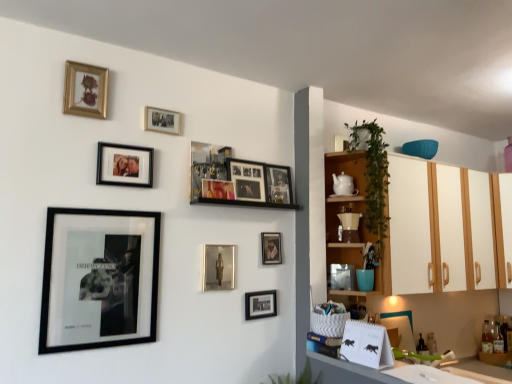
Question: Considering the relative sizes of green leafy plant at lower center, the 2th plant from the top, and matte black picture frame at center, the second picture frame positioned from the right, in the image provided, is green leafy plant at lower center, the 2th plant from the top, bigger than matte black picture frame at center, the second picture frame positioned from the right,?

Choices:
 (A) yes
 (B) no

Answer: (A)

Question: Would you consider green leafy plant at lower center, positioned as the 2th plant in right-to-left order, to be distant from matte black picture frame at center, the second picture frame positioned from the right?

Choices:
 (A) yes
 (B) no

Answer: (B)

Question: From the image's perspective, is green leafy plant at lower center, marked as the first plant in a left-to-right arrangement, on top of matte black picture frame at center, which is the 10th picture frame in left-to-right order?

Choices:
 (A) yes
 (B) no

Answer: (B)

Question: Is the position of green leafy plant at lower center, marked as the first plant in a left-to-right arrangement, more distant than that of matte black picture frame at center, which is the 10th picture frame in left-to-right order?

Choices:
 (A) no
 (B) yes

Answer: (A)

Question: Is green leafy plant at lower center, marked as the first plant in a left-to-right arrangement, taller than matte black picture frame at center, which is the 10th picture frame in left-to-right order?

Choices:
 (A) no
 (B) yes

Answer: (A)

Question: From a real-world perspective, relative to matte black photo frame at upper center, the 3th picture frame viewed from the left, is metallic/reflective picture frame at upper center, placed as the 5th picture frame when sorted from left to right, vertically above or below?

Choices:
 (A) above
 (B) below

Answer: (A)

Question: In the image, is metallic/reflective picture frame at upper center, the 7th picture frame positioned from the right, positioned in front of or behind matte black photo frame at upper center, the 3th picture frame viewed from the left?

Choices:
 (A) front
 (B) behind

Answer: (B)

Question: Is point (207, 145) closer or farther from the camera than point (96, 175)?

Choices:
 (A) farther
 (B) closer

Answer: (A)

Question: From the image's perspective, is metallic/reflective picture frame at upper center, placed as the 5th picture frame when sorted from left to right, positioned above or below matte black photo frame at upper center, the 3th picture frame viewed from the left?

Choices:
 (A) below
 (B) above

Answer: (A)

Question: Is matte black photo frame at upper center, the 9th picture frame viewed from the right, inside or outside of green leafy plant at upper right, which ranks as the 1th plant in top-to-bottom order?

Choices:
 (A) inside
 (B) outside

Answer: (B)

Question: Considering the positions of point (142, 163) and point (380, 167), is point (142, 163) closer or farther from the camera than point (380, 167)?

Choices:
 (A) farther
 (B) closer

Answer: (B)

Question: Considering their positions, is matte black photo frame at upper center, the 9th picture frame viewed from the right, located in front of or behind green leafy plant at upper right, placed as the first plant when sorted from right to left?

Choices:
 (A) front
 (B) behind

Answer: (A)

Question: Looking at their shapes, would you say matte black photo frame at upper center, the 3th picture frame viewed from the left, is wider or thinner than green leafy plant at upper right, placed as the first plant when sorted from right to left?

Choices:
 (A) wide
 (B) thin

Answer: (B)

Question: Is green leafy plant at lower center, positioned as the 2th plant in right-to-left order, inside or outside of gold-framed photo at upper center, the 8th picture frame in the right-to-left sequence?

Choices:
 (A) outside
 (B) inside

Answer: (A)

Question: In terms of height, does green leafy plant at lower center, the 2th plant from the top, look taller or shorter compared to gold-framed photo at upper center, the 8th picture frame in the right-to-left sequence?

Choices:
 (A) tall
 (B) short

Answer: (A)